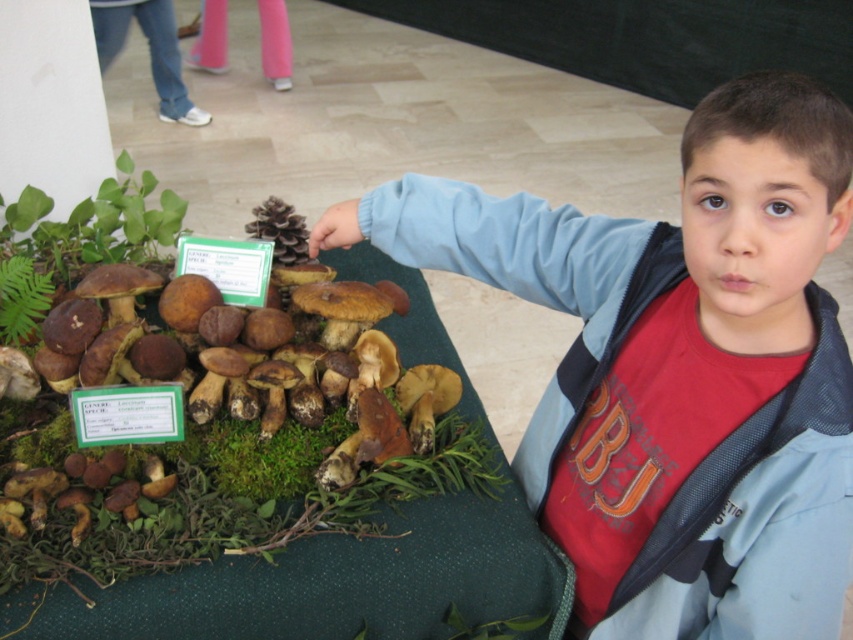
You are standing at the position of the boy in the image. There is a point marked at coordinates (264,454). What is located at that point?

At point (264,454) lies green moss at center.

You are a botanist examining the mushrooms on the green tablecloth. You need to locate the green moss at center. Where exactly is it positioned?

The green moss at center is positioned at coordinate point (264,454).

Based on the photo, you are standing in front of the display of mushrooms and want to place a new decorative item at the exact center of the display. The display is a rectangle with its top left corner at point A and bottom right corner at point B. Given that the green leafy plant at upper left is located at point C, can you determine if point C is inside the display area?

The green leafy plant at upper left is located at point C, which is at the upper left corner of the display. Since the display is a rectangle with its top left corner at point A, the point C is exactly at point A. Therefore, the point C is on the edge of the display area but not inside it.